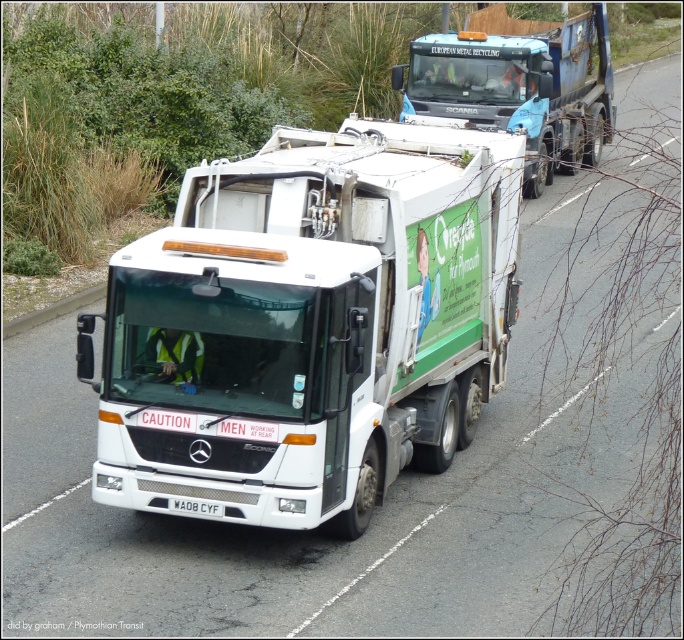
You are a delivery driver needing to pass through a narrow alley that can only accommodate vehicles up to 2.5 meters wide. You see the white matte garbage truck at center and the blue metallic garbage truck at center. Which truck should you choose to pass through the alley safely?

The blue metallic garbage truck at center has a narrower width than the white matte garbage truck at center, so you should choose the blue metallic garbage truck at center to pass through the alley safely.

You are a delivery driver who needs to pass through the area where the white matte garbage truck at center is located. There is a delivery point at coordinates point (308, 324). Can you safely navigate around the truck to reach the delivery point without blocking the road?

The delivery point at point (308, 324) is exactly where the white matte garbage truck at center is located. Therefore, you cannot safely navigate to that delivery point without obstructing the truck or the road.

Based on the photo, you are a delivery driver who needs to pass by the blue metallic garbage truck at center and the white plastic license plate at center. Since you need to avoid hitting any objects, which one should you be more cautious about in terms of height?

The blue metallic garbage truck at center is taller than the white plastic license plate at center, so you should be more cautious about the blue metallic garbage truck at center in terms of height.